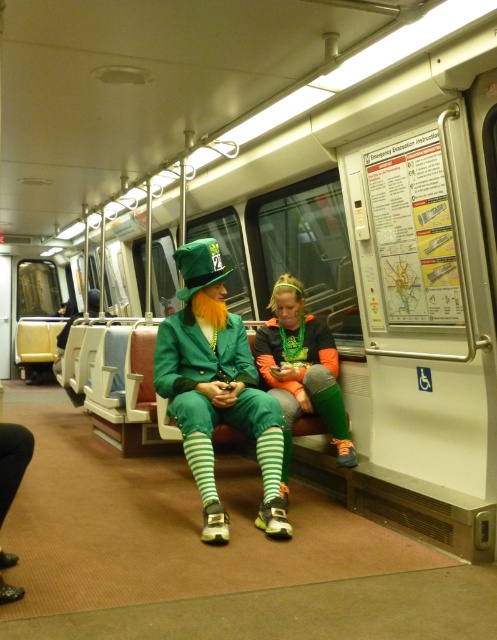
The width and height of the screenshot is (497, 640). What do you see at coordinates (217, 387) in the screenshot?
I see `shiny green suit at center` at bounding box center [217, 387].

Between shiny green suit at center and neon orange fabric leggings at center, which one is positioned lower?

Positioned lower is shiny green suit at center.

Which is in front, point (216, 417) or point (345, 445)?

Positioned in front is point (216, 417).

Identify the location of shiny green suit at center. (217, 387).